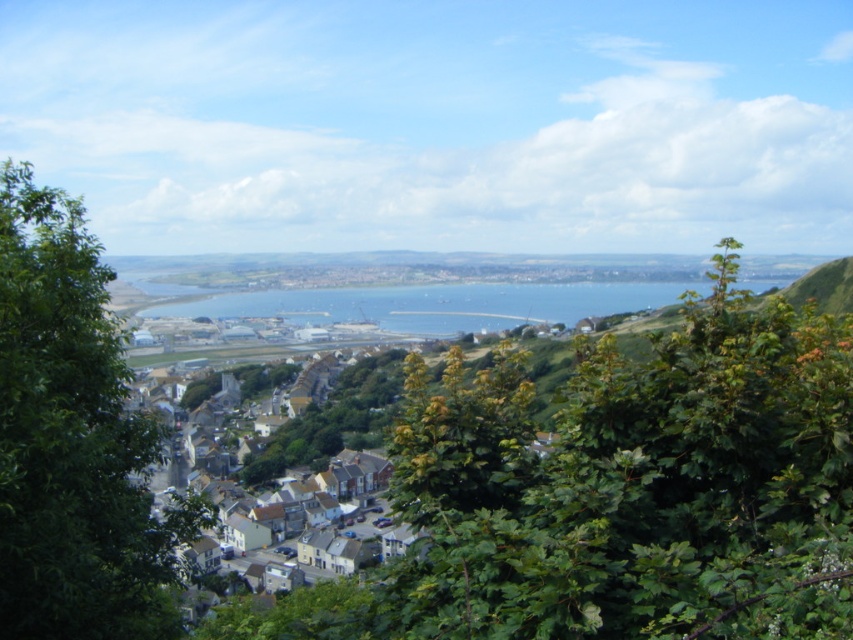
Question: Which of the following is the farthest from the observer?

Choices:
 (A) (33, 340)
 (B) (256, 484)

Answer: (B)

Question: In this image, where is green leafy tree at left located relative to white matte houses at center?

Choices:
 (A) above
 (B) below

Answer: (A)

Question: Considering the relative positions of green leafy tree at left and white matte houses at center in the image provided, where is green leafy tree at left located with respect to white matte houses at center?

Choices:
 (A) left
 (B) right

Answer: (B)

Question: Does green leafy tree at left have a smaller size compared to white matte houses at center?

Choices:
 (A) no
 (B) yes

Answer: (B)